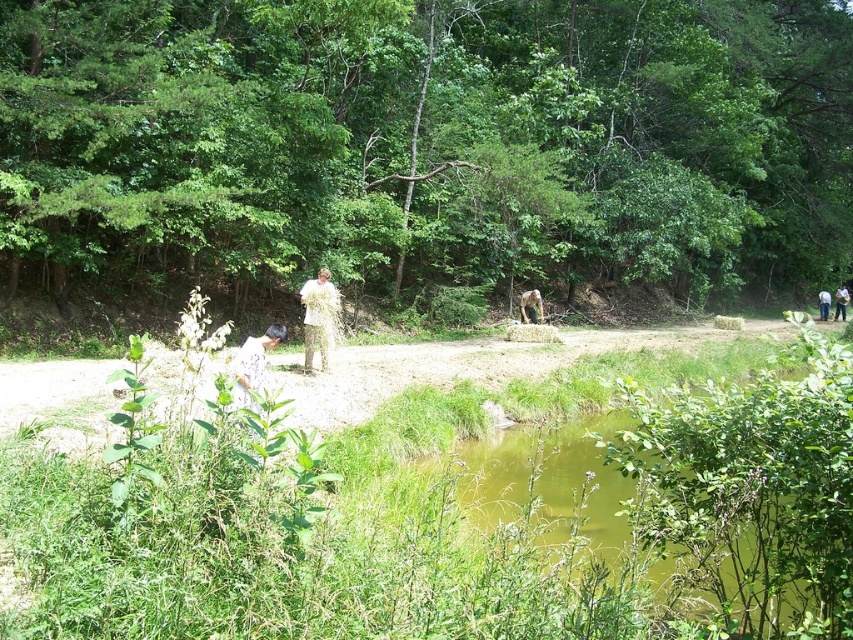
You are standing on the dirt path and want to avoid stepping into the green murky water at lower center. Based on its location at point coordinates, which direction should you move to stay clear of it?

The green murky water at lower center is located at coordinates point (698, 497). To avoid stepping into it, move away from that point, which would likely be to the upper left or right depending on your current position along the dirt path.

You are standing at the starting point of the dirt path. You want to reach the green leafy tree at center. Which direction should you walk to get there?

The green leafy tree at center is located at point (x=425, y=145), so you should walk towards the center of the image to reach it.

You are standing at point (305, 314) and want to walk to the water. There is a person at point (262, 385). Which direction should you go to avoid walking behind them?

Point (262, 385) is in front of point (305, 314), so to avoid walking behind them, you should move around to the side or behind the person at point (262, 385) since they are ahead of your current position.